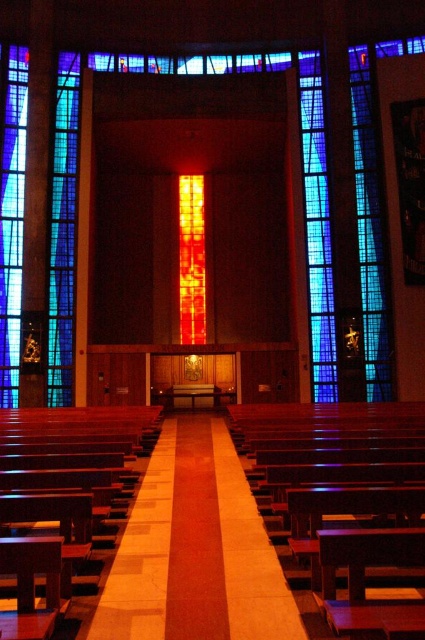
Question: Is mahogany wood church bench at lower left smaller than translucent stained glass at left?

Choices:
 (A) yes
 (B) no

Answer: (B)

Question: Which point is farther to the camera?

Choices:
 (A) (39, 547)
 (B) (14, 232)

Answer: (B)

Question: Which of the following is the closest to the observer?

Choices:
 (A) wooden aisle at center
 (B) translucent stained glass at left
 (C) wooden church bench at center
 (D) mahogany wood church bench at lower left

Answer: (C)

Question: Can you confirm if wooden church bench at center is positioned to the left of wooden aisle at center?

Choices:
 (A) no
 (B) yes

Answer: (A)

Question: Estimate the real-world distances between objects in this image. Which object is closer to the wooden aisle at center?

Choices:
 (A) wooden church bench at center
 (B) translucent stained glass at left

Answer: (A)

Question: Is wooden aisle at center further to the viewer compared to mahogany wood church bench at lower left?

Choices:
 (A) no
 (B) yes

Answer: (B)